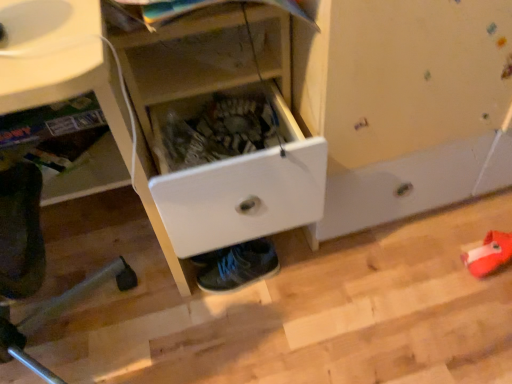
Question: Does white plastic drawer at center have a lesser width compared to shiny blue sneakers at lower center?

Choices:
 (A) no
 (B) yes

Answer: (A)

Question: Considering the relative positions of white plastic drawer at center and shiny blue sneakers at lower center in the image provided, is white plastic drawer at center behind shiny blue sneakers at lower center?

Choices:
 (A) no
 (B) yes

Answer: (A)

Question: From a real-world perspective, is white plastic drawer at center positioned under shiny blue sneakers at lower center based on gravity?

Choices:
 (A) no
 (B) yes

Answer: (A)

Question: Can you confirm if white plastic drawer at center is positioned to the right of shiny blue sneakers at lower center?

Choices:
 (A) yes
 (B) no

Answer: (B)

Question: Considering the relative positions of white plastic drawer at center and shiny blue sneakers at lower center in the image provided, is white plastic drawer at center to the left of shiny blue sneakers at lower center from the viewer's perspective?

Choices:
 (A) yes
 (B) no

Answer: (A)

Question: Would you say white plastic drawer at center is outside shiny blue sneakers at lower center?

Choices:
 (A) no
 (B) yes

Answer: (B)

Question: Is shiny blue sneakers at lower center positioned in front of white plastic drawer at center?

Choices:
 (A) yes
 (B) no

Answer: (B)

Question: Does shiny blue sneakers at lower center appear on the right side of white plastic drawer at center?

Choices:
 (A) no
 (B) yes

Answer: (B)

Question: From the image's perspective, is shiny blue sneakers at lower center above white plastic drawer at center?

Choices:
 (A) no
 (B) yes

Answer: (A)

Question: Can you confirm if shiny blue sneakers at lower center is taller than white plastic drawer at center?

Choices:
 (A) yes
 (B) no

Answer: (B)

Question: Considering the relative sizes of shiny blue sneakers at lower center and white plastic drawer at center in the image provided, is shiny blue sneakers at lower center smaller than white plastic drawer at center?

Choices:
 (A) no
 (B) yes

Answer: (B)

Question: From the image's perspective, is shiny blue sneakers at lower center under white plastic drawer at center?

Choices:
 (A) yes
 (B) no

Answer: (A)

Question: Is white plastic drawer at center at the left side of white plastic drawer at center?

Choices:
 (A) no
 (B) yes

Answer: (A)